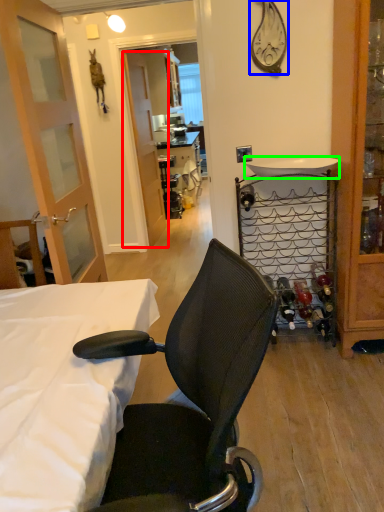
Question: Which object is the farthest from screen door (highlighted by a red box)? Choose among these: clock (highlighted by a blue box) or sink (highlighted by a green box).

Choices:
 (A) clock
 (B) sink

Answer: (A)